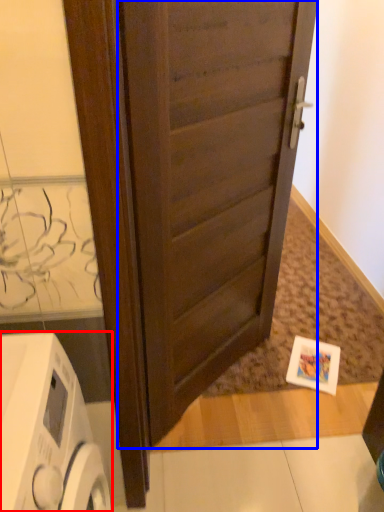
Question: Which point is further to the camera, home appliance (highlighted by a red box) or door (highlighted by a blue box)?

Choices:
 (A) home appliance
 (B) door

Answer: (B)